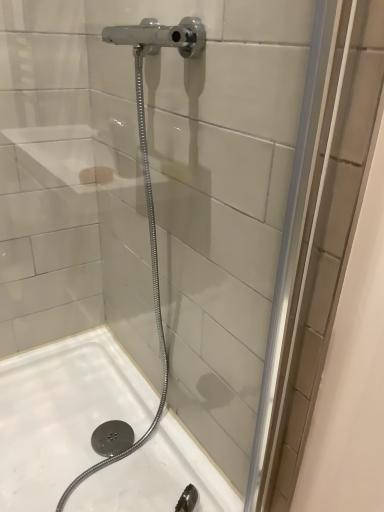
Question: Should I look upward or downward to see white glossy bath at lower center?

Choices:
 (A) down
 (B) up

Answer: (A)